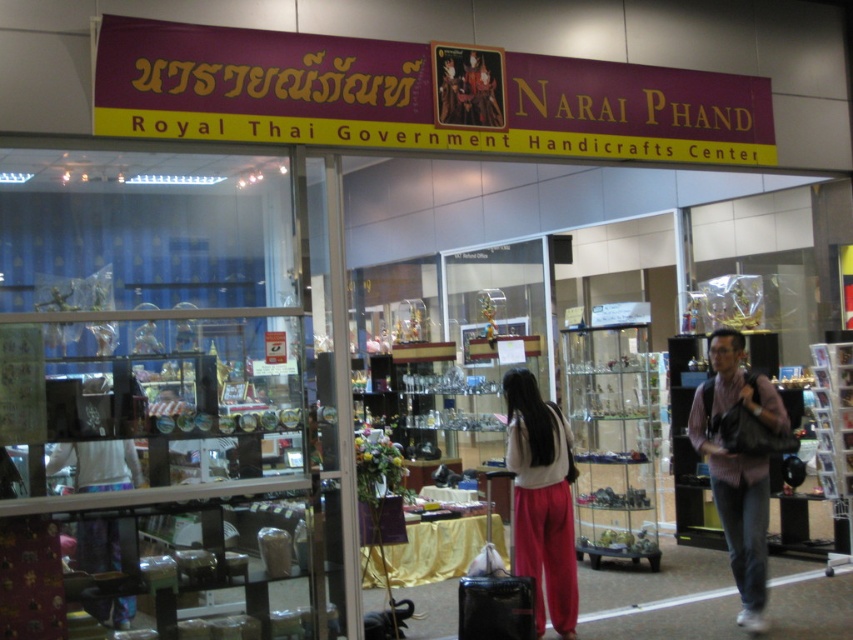
Between transparent glass display case at left and white fabric pants at center, which one has more height?

Standing taller between the two is transparent glass display case at left.

From the picture: Can you confirm if transparent glass display case at left is smaller than white fabric pants at center?

Actually, transparent glass display case at left might be larger than white fabric pants at center.

Measure the distance between point (280, 490) and camera.

The distance of point (280, 490) from camera is 16.88 feet.

Locate an element on the screen. This screenshot has width=853, height=640. transparent glass display case at left is located at coordinates (163, 387).

Measure the distance between point (61, 316) and camera.

Point (61, 316) is 4.75 meters from camera.

Measure the distance between transparent glass display case at left and camera.

A distance of 4.53 meters exists between transparent glass display case at left and camera.

The height and width of the screenshot is (640, 853). Identify the location of transparent glass display case at left. coord(163,387).

Who is higher up, pink striped shirt at center or white fabric pants at center?

pink striped shirt at center

Which is more to the left, pink striped shirt at center or white fabric pants at center?

white fabric pants at center

Does point (752, 561) lie in front of point (560, 481)?

Yes, it is in front of point (560, 481).

The height and width of the screenshot is (640, 853). Identify the location of pink striped shirt at center. (738, 465).